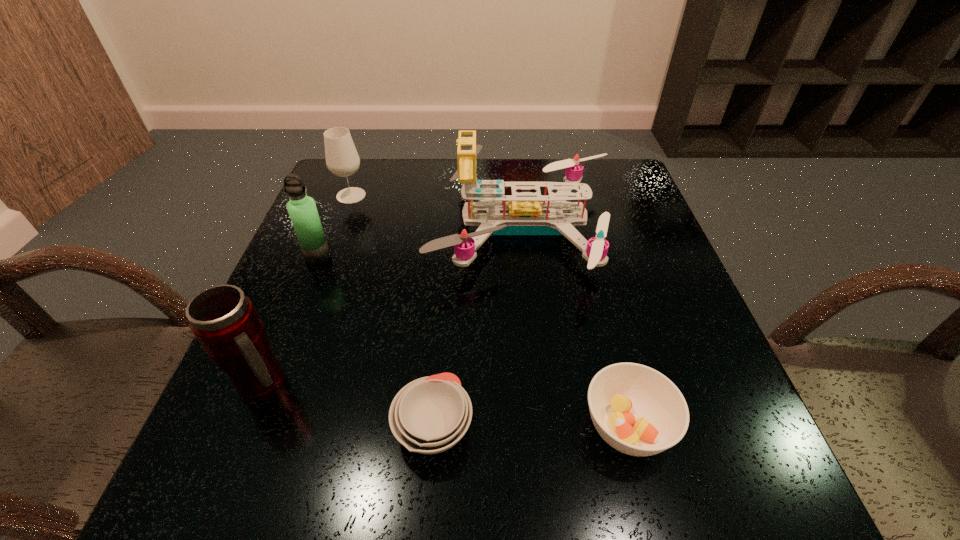
This screenshot has height=540, width=960. Identify the location of object present at the far left corner. (342, 159).

Identify the location of object situated at the far right corner. (520, 215).

Find the location of a particular element. Image resolution: width=960 pixels, height=540 pixels. object present at the near right corner is located at coordinates (638, 411).

Identify the location of vacant space at the far edge of the desktop. This screenshot has width=960, height=540. (393, 205).

Find the location of a particular element. This screenshot has width=960, height=540. vacant space at the near edge of the desktop is located at coordinates (450, 457).

The image size is (960, 540). In the image, there is a desktop. Identify the location of free region at the left edge. (309, 334).

I want to click on vacant space at the right edge of the desktop, so click(618, 269).

Image resolution: width=960 pixels, height=540 pixels. What are the coordinates of `free space at the near left corner of the desktop` in the screenshot? It's located at (220, 505).

In the image, there is a desktop. What are the coordinates of `vacant area at the far right corner` in the screenshot? It's located at (593, 161).

Identify the location of free space between the glass and the farther thermos bottle. point(334,226).